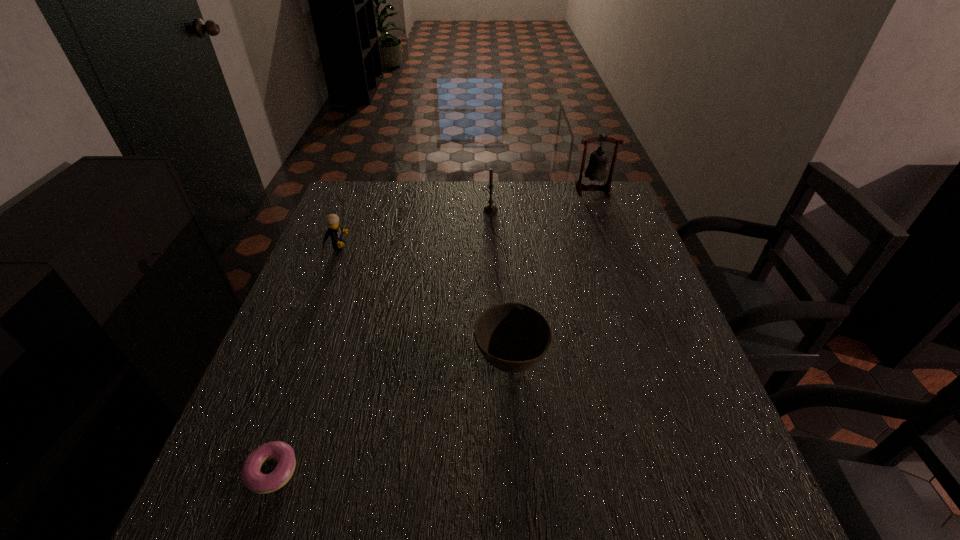
Where is `free space between the nearest object and the farthest object`? The height and width of the screenshot is (540, 960). free space between the nearest object and the farthest object is located at coordinates (433, 331).

Image resolution: width=960 pixels, height=540 pixels. I want to click on vacant space that is in between the Lego and the bell, so click(x=465, y=218).

Identify the location of free spot between the shortest object and the tallest object. This screenshot has width=960, height=540. (433, 331).

At what (x,y) coordinates should I click in order to perform the action: click on empty space that is in between the rightmost object and the bowl. Please return your answer as a coordinate pair (x, y). Image resolution: width=960 pixels, height=540 pixels. Looking at the image, I should click on (552, 276).

Locate an element on the screen. The height and width of the screenshot is (540, 960). vacant point located between the candle and the nearest object is located at coordinates 382,340.

Find the location of a particular element. empty location between the farthest object and the second nearest object is located at coordinates (552, 276).

Find the location of `vacant region between the rightmost object and the bowl`. vacant region between the rightmost object and the bowl is located at coordinates (552, 276).

This screenshot has height=540, width=960. What are the coordinates of `vacant space that is in between the second tallest object and the doughnut` in the screenshot? It's located at (382, 340).

This screenshot has width=960, height=540. What are the coordinates of `object that stands as the third closest to the shortest object` in the screenshot? It's located at (490, 208).

The width and height of the screenshot is (960, 540). I want to click on the second closest object relative to the shortest object, so click(x=334, y=231).